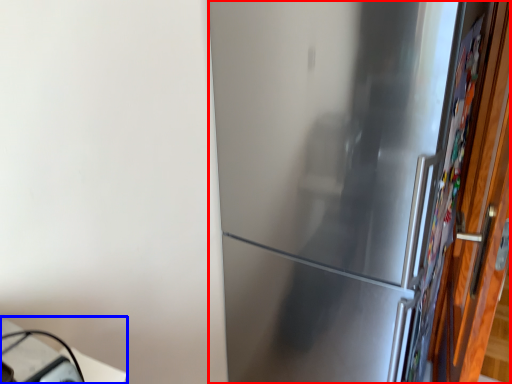
Question: Which point is further to the camera, refrigerator (highlighted by a red box) or table (highlighted by a blue box)?

Choices:
 (A) refrigerator
 (B) table

Answer: (A)